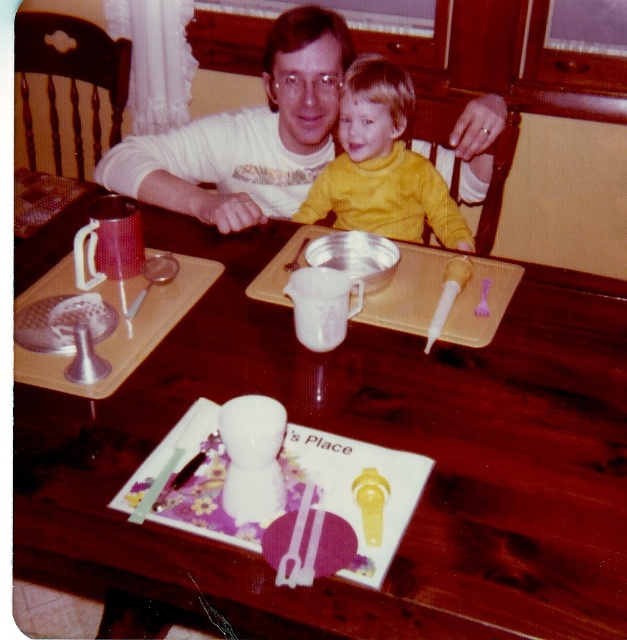
Is wooden table at center smaller than yellow matte shirt at center?

Incorrect, wooden table at center is not smaller in size than yellow matte shirt at center.

Does wooden table at center have a lesser width compared to yellow matte shirt at center?

In fact, wooden table at center might be wider than yellow matte shirt at center.

Does point (530, 378) lie behind point (408, 115)?

No, (530, 378) is closer to viewer.

You are a GUI agent. You are given a task and a screenshot of the screen. Output one action in this format:
    pyautogui.click(x=<x>, y=<y>)
    Task: Click on the wooden table at center
    The width and height of the screenshot is (627, 640).
    Given the screenshot: What is the action you would take?
    pyautogui.click(x=366, y=440)

Which is below, wooden table at center or white matte shirt at upper center?

wooden table at center

Is point (470, 416) closer to camera compared to point (487, 131)?

Yes.

Locate an element on the screen. This screenshot has height=640, width=627. wooden table at center is located at coordinates (366, 440).

Can you confirm if white matte shirt at upper center is positioned to the right of yellow matte shirt at center?

In fact, white matte shirt at upper center is to the left of yellow matte shirt at center.

Is point (192, 136) in front of point (436, 220)?

No.

I want to click on white matte shirt at upper center, so click(x=248, y=134).